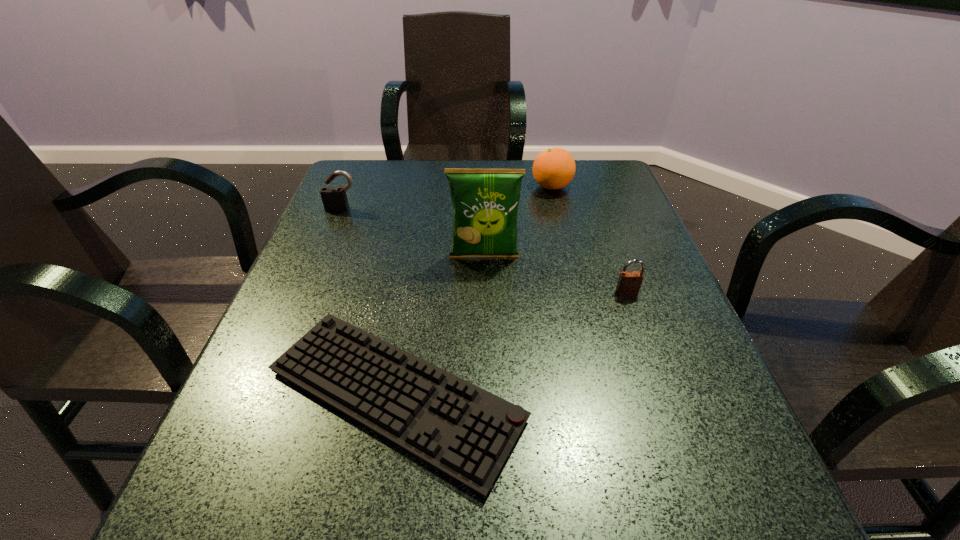
Locate an element on the screen. The image size is (960, 540). padlock present at the right edge is located at coordinates (629, 283).

Find the location of a particular element. object present at the near left corner is located at coordinates (462, 430).

Where is `object that is at the far right corner`? This screenshot has height=540, width=960. object that is at the far right corner is located at coordinates (554, 168).

In the image, there is a desktop. Where is `vacant space at the far edge`? vacant space at the far edge is located at coordinates (404, 164).

Where is `free region at the near edge of the desktop`? free region at the near edge of the desktop is located at coordinates (553, 516).

In the image, there is a desktop. Where is `vacant area at the left edge`? vacant area at the left edge is located at coordinates (358, 323).

At what (x,y) coordinates should I click in order to perform the action: click on vacant point at the right edge. Please return your answer as a coordinate pair (x, y). Looking at the image, I should click on (652, 359).

Image resolution: width=960 pixels, height=540 pixels. In order to click on free space at the far left corner in this screenshot , I will do click(x=351, y=193).

Find the location of a particular element. empty space between the third farthest object and the shortest object is located at coordinates (440, 326).

You are a GUI agent. You are given a task and a screenshot of the screen. Output one action in this format:
    pyautogui.click(x=<x>, y=<y>)
    Task: Click on the free point between the orange and the fourth farthest object
    The image size is (960, 540).
    Given the screenshot: What is the action you would take?
    pyautogui.click(x=589, y=239)